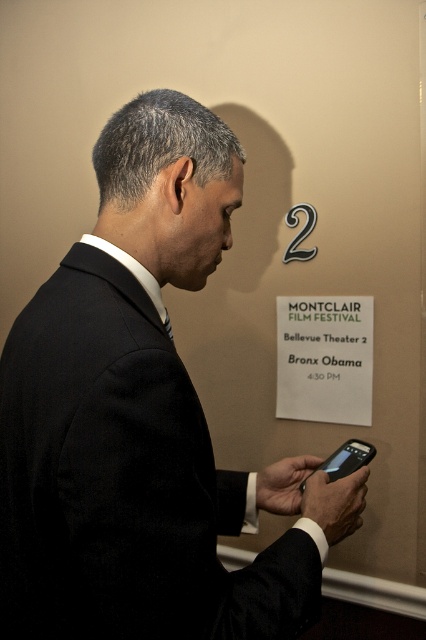
You are a photographer standing at a distance of 20 inches from the subject. You want to take a portrait of the black matte suit at center. Is the current distance sufficient for a clear portrait?

The distance of black matte suit at center from camera is 20.61 inches, which is slightly more than your current position of 20 inches. To ensure a clear portrait, you should move back a little closer to the recommended 20.61 inches.

You are a photographer at the Montclair Film Festival. You want to take a photo of the black matte suit at center and the white paper sign at upper center. Which object will appear larger in your photo?

The black matte suit at center will appear larger in the photo because it is closer to the viewer than the white paper sign at upper center.

You are a film festival attendee standing in front of the theater. You see two points marked on the screen. The first point is at coordinates point (118,161) and the second point is at coordinates point (368,330). Which point is closer to you?

Point (118,161) is in front of point (368,330), so it is closer to you.